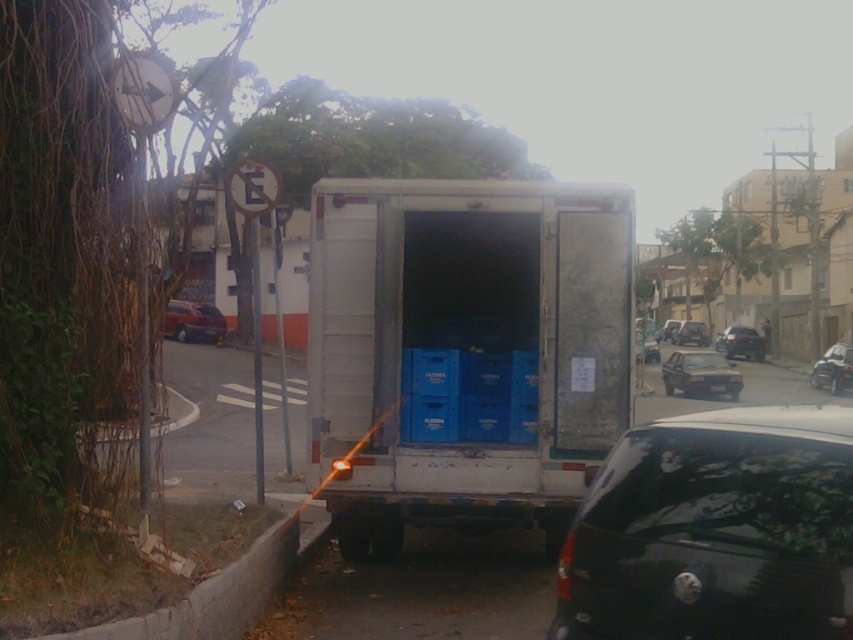
Can you confirm if white matte truck at center is shorter than shiny silver sedan at center?

Incorrect, white matte truck at center's height does not fall short of shiny silver sedan at center's.

Does white matte truck at center have a larger size compared to shiny silver sedan at center?

Incorrect, white matte truck at center is not larger than shiny silver sedan at center.

Which is behind, point (405, 196) or point (672, 340)?

The point (672, 340) is more distant.

The width and height of the screenshot is (853, 640). In order to click on white matte truck at center in this screenshot , I will do `click(463, 349)`.

How distant is shiny silver sedan at center from white plastic license plate at center?

They are 38.52 meters apart.

Between shiny silver sedan at center and white plastic license plate at center, which one is positioned lower?

Positioned lower is white plastic license plate at center.

Image resolution: width=853 pixels, height=640 pixels. I want to click on shiny silver sedan at center, so click(689, 333).

The width and height of the screenshot is (853, 640). I want to click on metallic silver sedan at center, so click(741, 342).

Between point (744, 340) and point (724, 387), which one is positioned in front?

Point (724, 387) is in front.

Does point (722, 337) lie behind point (714, 387)?

Yes.

The height and width of the screenshot is (640, 853). Identify the location of metallic silver sedan at center. (741, 342).